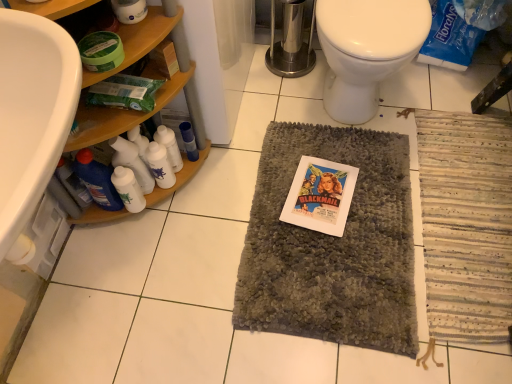
Where is `blank area beneath gray shaggy mat at center (from a real-world perspective)`? The height and width of the screenshot is (384, 512). blank area beneath gray shaggy mat at center (from a real-world perspective) is located at coordinates (347, 227).